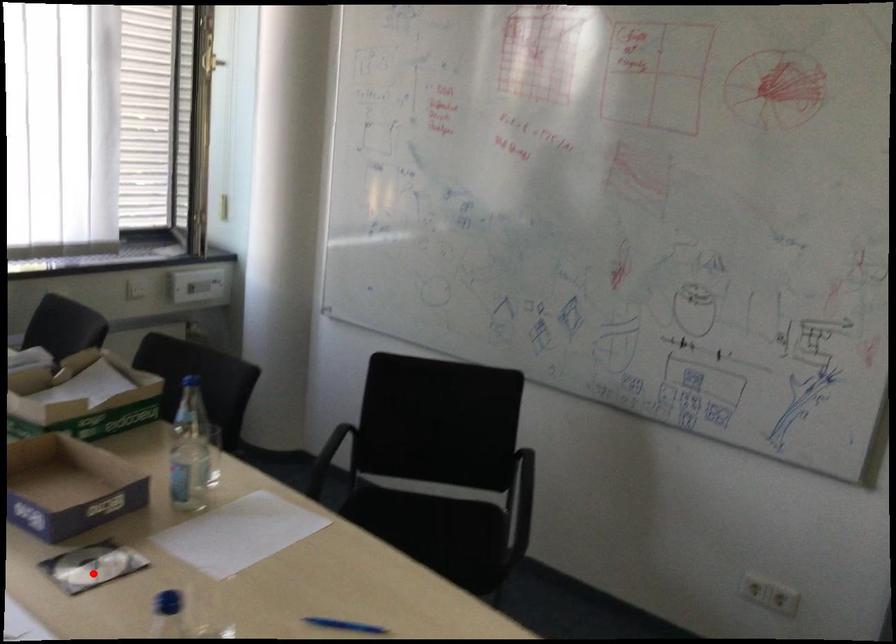
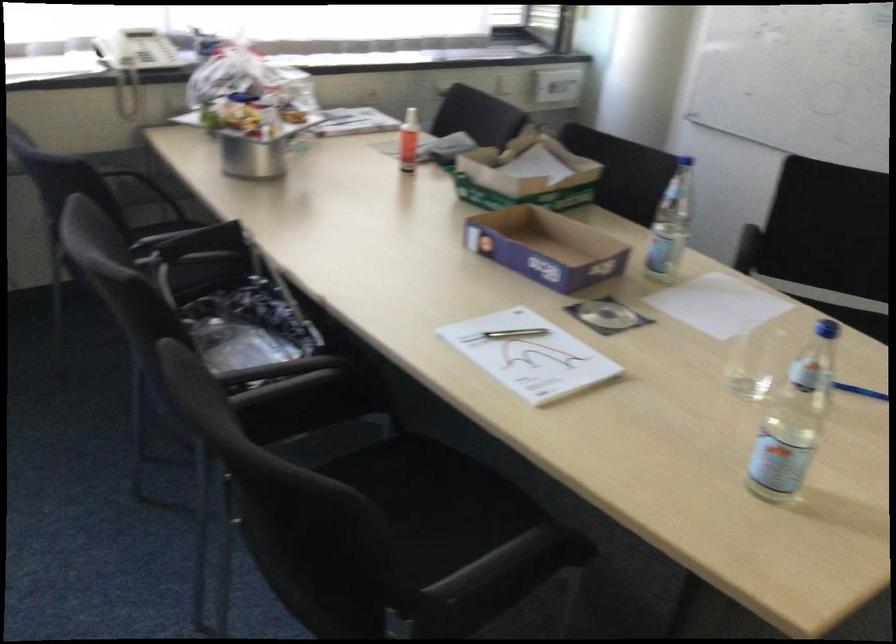
Question: I am providing you with two images of the same scene from different viewpoints. A red point is shown in image1. For the corresponding object point in image2, is it positioned nearer or farther from the camera?

Choices:
 (A) Nearer
 (B) Farther

Answer: (B)